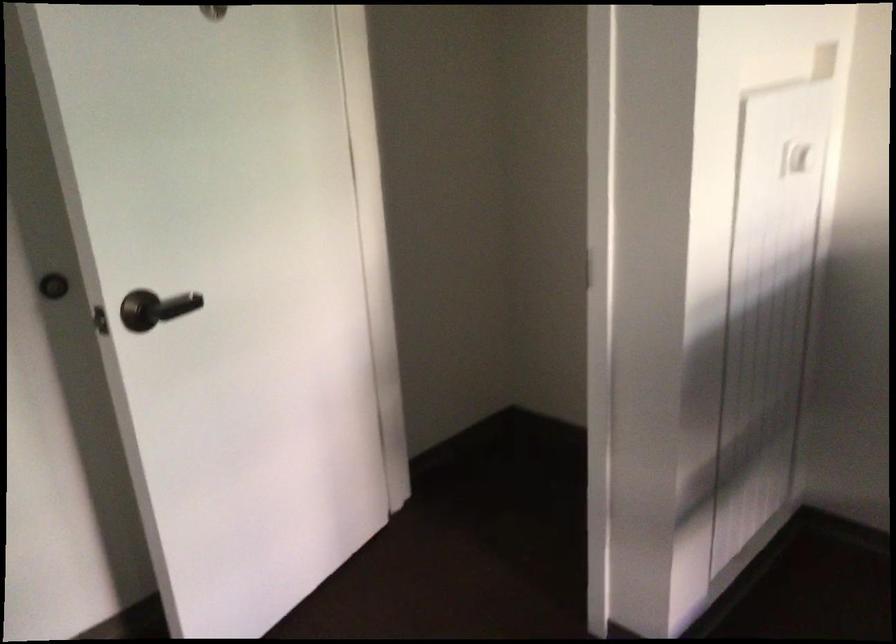
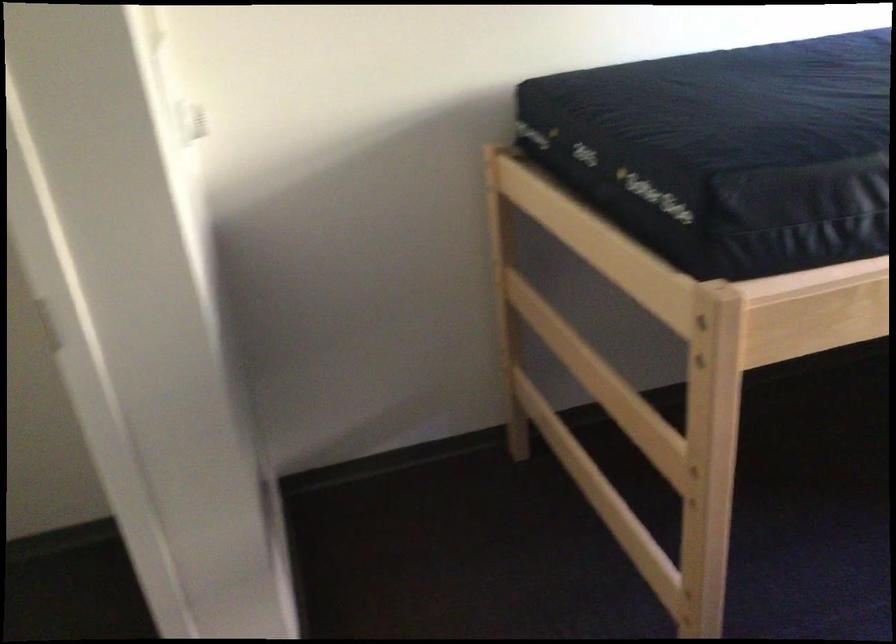
The point at (806, 140) is marked in the first image. Where is the corresponding point in the second image?

(190, 117)